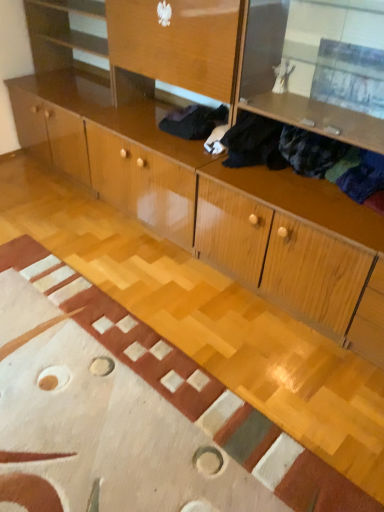
Question: From a real-world perspective, relative to dark blue fabric at upper right, positioned as the 1th clothing in front-to-back order, is black fabric at center, the first clothing positioned from the back, vertically above or below?

Choices:
 (A) above
 (B) below

Answer: (B)

Question: Relative to dark blue fabric at upper right, positioned as the 1th clothing in front-to-back order, is black fabric at center, the first clothing positioned from the back, in front or behind?

Choices:
 (A) front
 (B) behind

Answer: (B)

Question: Is point (221, 115) positioned closer to the camera than point (367, 164)?

Choices:
 (A) farther
 (B) closer

Answer: (A)

Question: In terms of width, does dark blue fabric at upper right, positioned as the 2th clothing in back-to-front order, look wider or thinner when compared to black fabric at center, the first clothing positioned from the back?

Choices:
 (A) thin
 (B) wide

Answer: (A)

Question: Is dark blue fabric at upper right, positioned as the 1th clothing in front-to-back order, spatially inside black fabric at center, the first clothing positioned from the back, or outside of it?

Choices:
 (A) inside
 (B) outside

Answer: (B)

Question: Is dark blue fabric at upper right, positioned as the 2th clothing in back-to-front order, taller or shorter than black fabric at center, the 2th clothing viewed from the front?

Choices:
 (A) short
 (B) tall

Answer: (B)

Question: From a real-world perspective, is dark blue fabric at upper right, positioned as the 2th clothing in back-to-front order, physically located above or below black fabric at center, the 2th clothing viewed from the front?

Choices:
 (A) above
 (B) below

Answer: (A)